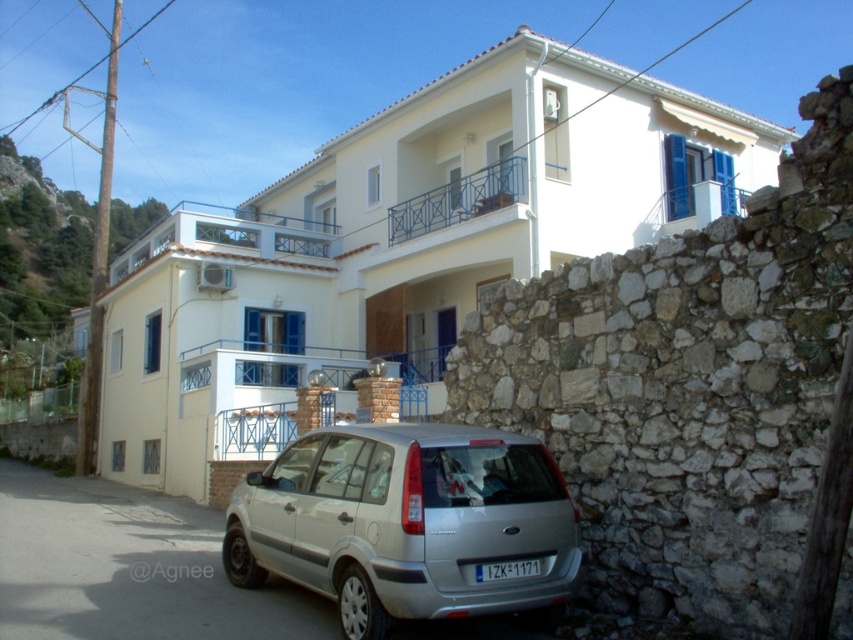
You are standing at the entrance of the two story residential building and want to park your car. The parking spot is at point 0.819, 0.479. Is the silver metallic hatchback at lower center blocking your way to the parking spot?

The silver metallic hatchback at lower center is positioned exactly at the parking spot coordinates (x=408, y=524), so it is blocking the parking spot. You will need to move it before parking there.